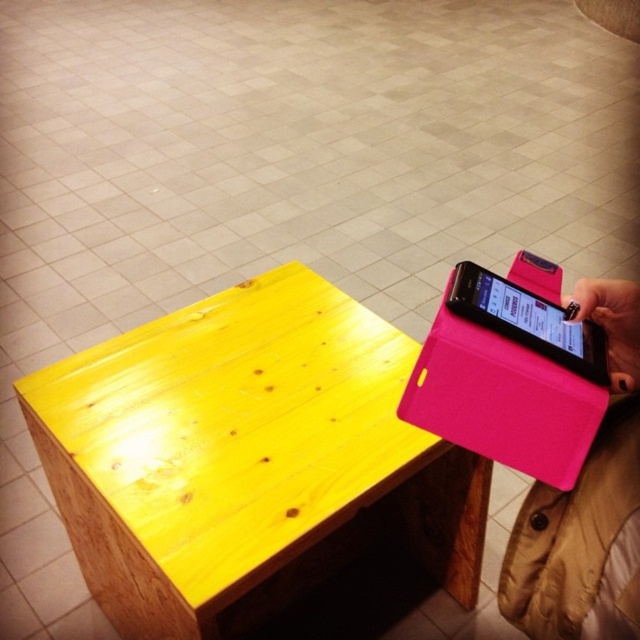
Question: Based on their relative distances, which object is nearer to the yellow wood table at upper left?

Choices:
 (A) pink leather wallet at lower right
 (B) matte black smartphone at upper right

Answer: (A)

Question: Does pink leather wallet at lower right lie in front of matte black smartphone at upper right?

Choices:
 (A) no
 (B) yes

Answer: (B)

Question: In this image, where is yellow wood table at upper left located relative to matte black smartphone at upper right?

Choices:
 (A) above
 (B) below

Answer: (B)

Question: From the image, what is the correct spatial relationship of pink leather wallet at lower right in relation to matte black smartphone at upper right?

Choices:
 (A) left
 (B) right

Answer: (B)

Question: Which point is farther from the camera taking this photo?

Choices:
 (A) (248, 317)
 (B) (499, 605)

Answer: (A)

Question: Among these points, which one is nearest to the camera?

Choices:
 (A) (189, 323)
 (B) (628, 368)

Answer: (B)